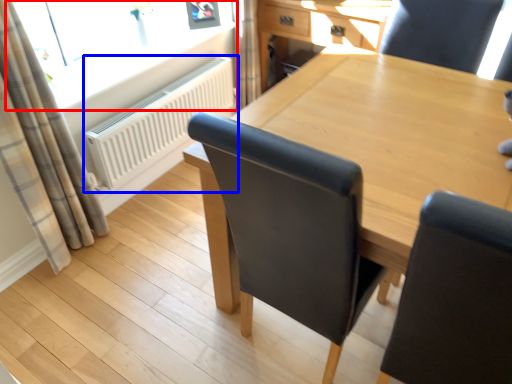
Question: Which object appears farthest to the camera in this image, window (highlighted by a red box) or radiator (highlighted by a blue box)?

Choices:
 (A) window
 (B) radiator

Answer: (B)